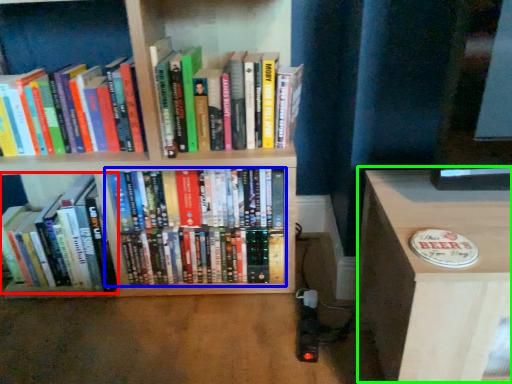
Question: Which is farther away from book (highlighted by a red box)? book (highlighted by a blue box) or table (highlighted by a green box)?

Choices:
 (A) book
 (B) table

Answer: (B)